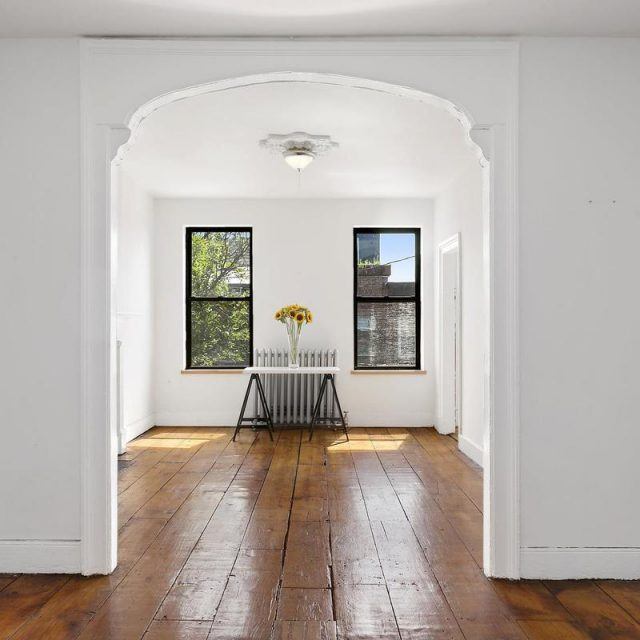
You are a GUI agent. You are given a task and a screenshot of the screen. Output one action in this format:
    pyautogui.click(x=<x>, y=<y>)
    Task: Click on the baseboard
    This screenshot has width=640, height=640.
    Given the screenshot: What is the action you would take?
    pyautogui.click(x=38, y=557), pyautogui.click(x=548, y=562)